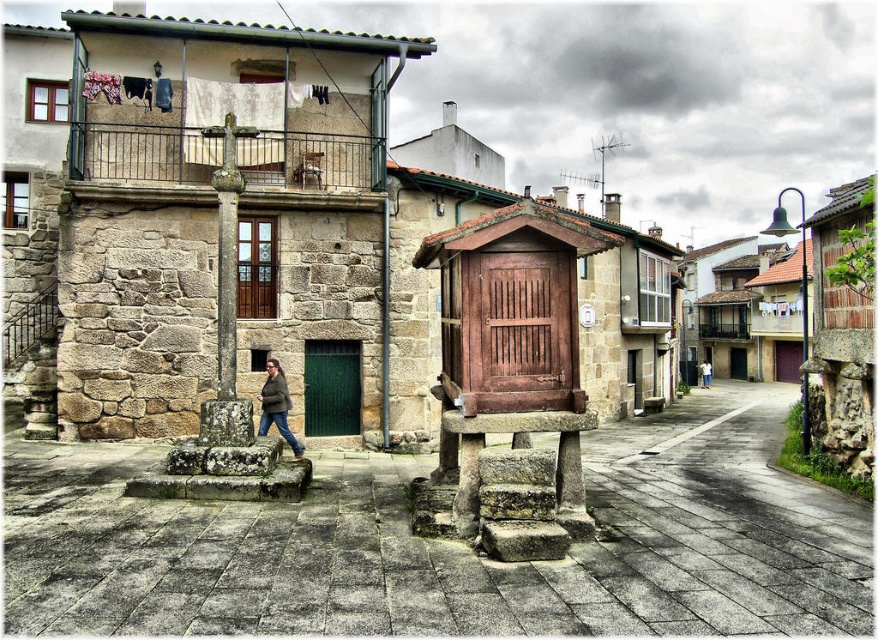
You are standing at the point labeled as point (447, 545) in the image. Based on the scene description, what is the immediate environment around you?

The immediate environment around point (447, 545) is the stone alley at center.

You are standing in the middle of the stone alley at center and looking towards the brown leather jacket at center. Which object is taller from your perspective?

The brown leather jacket at center is taller than the stone alley at center from your perspective.

You are standing on the rustic street and want to take a photo. There are two points marked in the scene, point 1 at coordinates point (426, 554) and point 2 at coordinates point (709, 387). Which point should you focus on to ensure it appears larger in your photo?

Point 1 at coordinates point (426, 554) is closer to the camera, so it will appear larger in the photo.